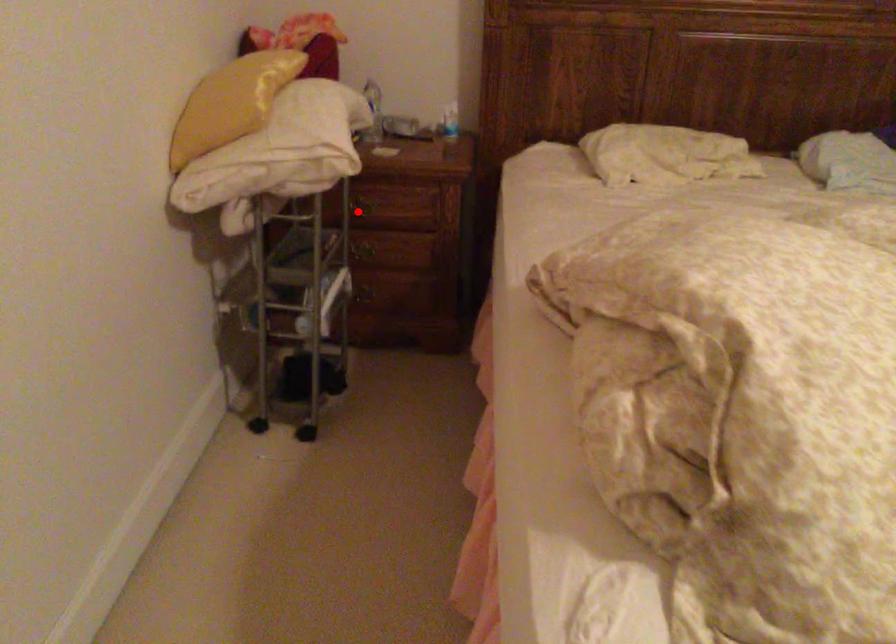
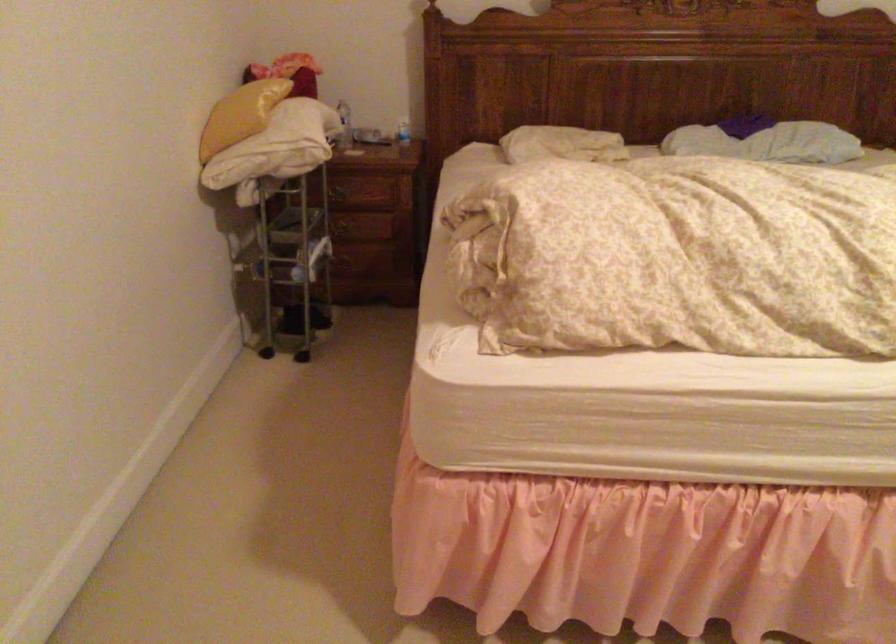
Question: I am providing you with two images of the same scene from different viewpoints. A red point is shown in image1. For the corresponding object point in image2, is it positioned nearer or farther from the camera?

Choices:
 (A) Nearer
 (B) Farther

Answer: (B)